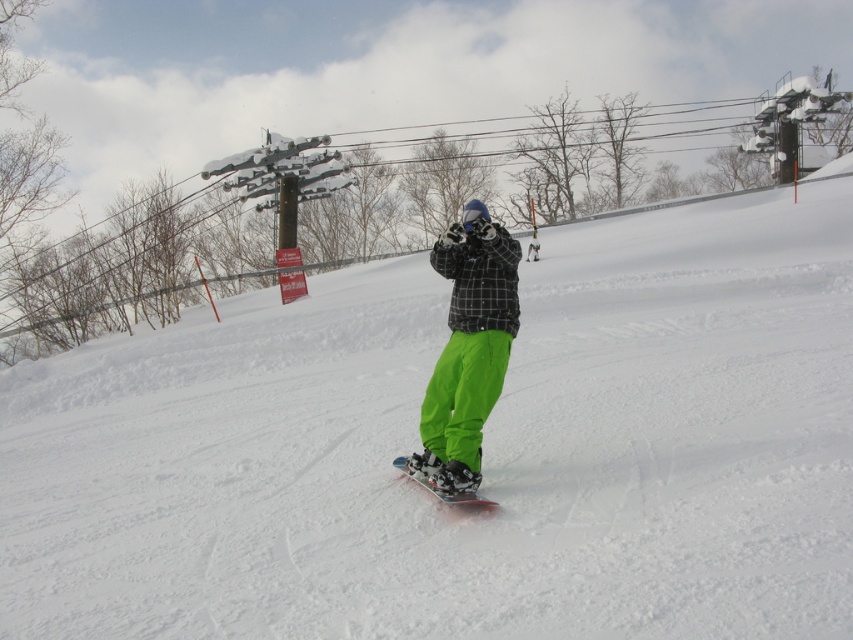
Between neon green pants at center and black matte snowboard at center, which one has more height?

With more height is neon green pants at center.

Who is more forward, (476, 433) or (462, 504)?

Point (462, 504) is in front.

The height and width of the screenshot is (640, 853). Describe the element at coordinates (467, 353) in the screenshot. I see `neon green pants at center` at that location.

Locate an element on the screen. The image size is (853, 640). neon green pants at center is located at coordinates (467, 353).